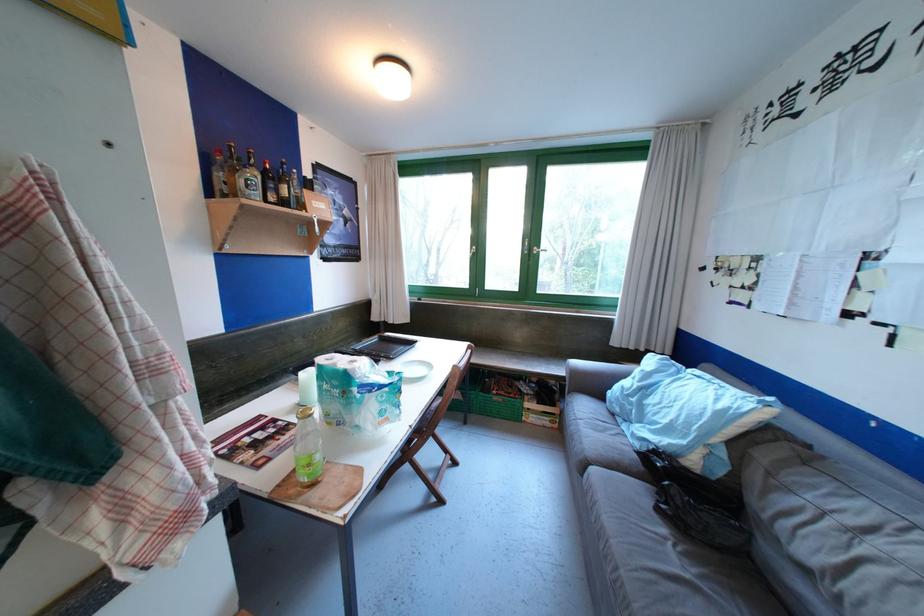
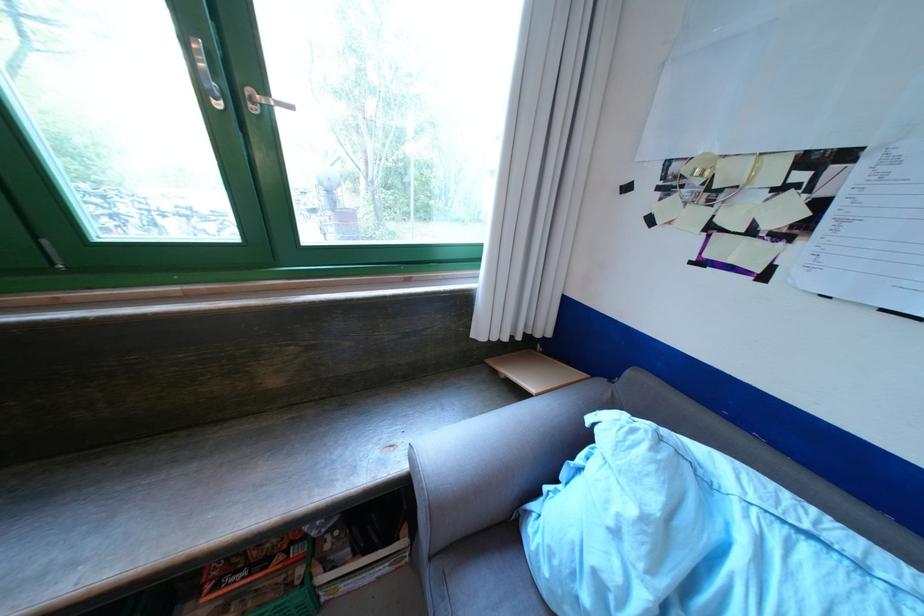
Find the pixel in the second image that matches point 545,249 in the first image.

(272, 92)